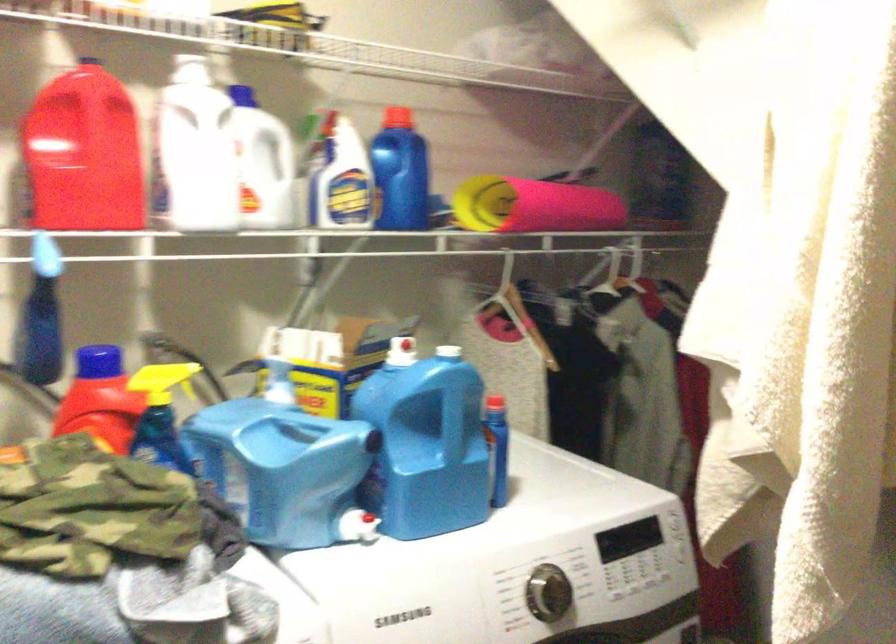
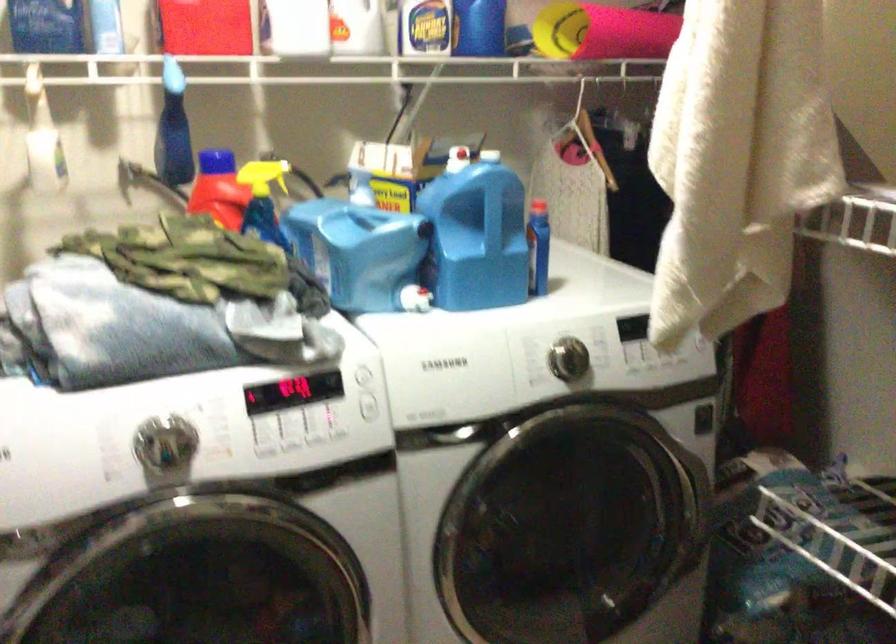
Locate, in the second image, the point that corresponds to the point at 288,404 in the first image.

(367, 207)